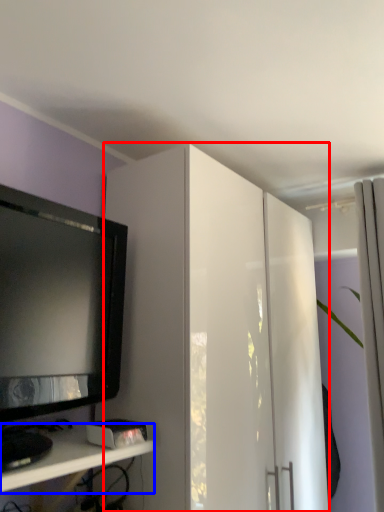
Question: Which object is closer to the camera taking this photo, cabinetry (highlighted by a red box) or shelf (highlighted by a blue box)?

Choices:
 (A) cabinetry
 (B) shelf

Answer: (B)